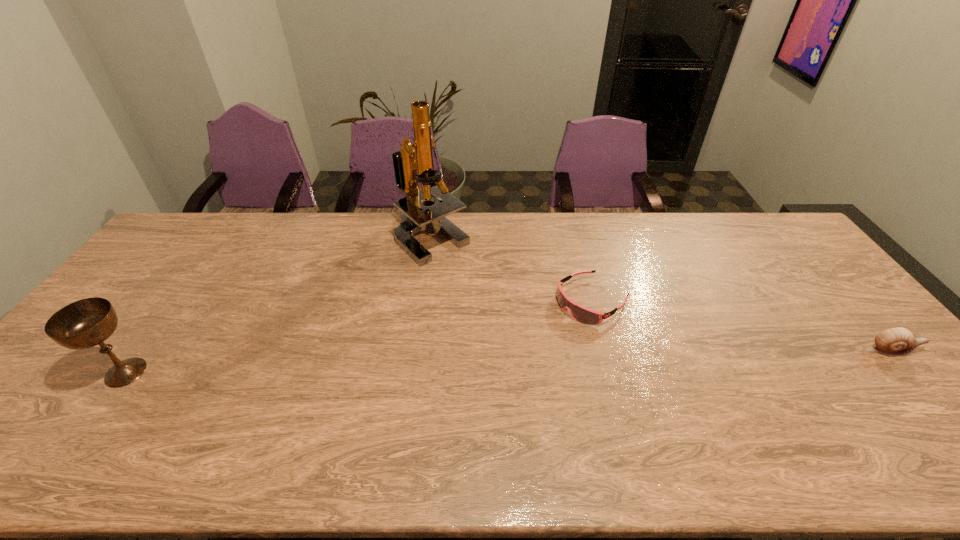
Find the location of a particular element. This screenshot has width=960, height=540. free spot located 0.380m on the front-facing side of the shortest object is located at coordinates (459, 385).

Identify the location of blank area located on the front-facing side of the shortest object. (491, 365).

Locate an element on the screen. The width and height of the screenshot is (960, 540). free point located at the eyepiece of the tallest object is located at coordinates (446, 300).

This screenshot has height=540, width=960. Identify the location of vacant space located 0.200m at the eyepiece of the tallest object. (449, 309).

This screenshot has width=960, height=540. Identify the location of vacant space located 0.340m at the eyepiece of the tallest object. (459, 346).

Find the location of `object situated at the far edge`. object situated at the far edge is located at coordinates (411, 158).

The image size is (960, 540). Identify the location of object located at the near edge. (85, 323).

Locate an element on the screen. object situated at the left edge is located at coordinates [85, 323].

The height and width of the screenshot is (540, 960). I want to click on object located at the right edge, so click(898, 341).

Locate an element on the screen. object present at the near left corner is located at coordinates (85, 323).